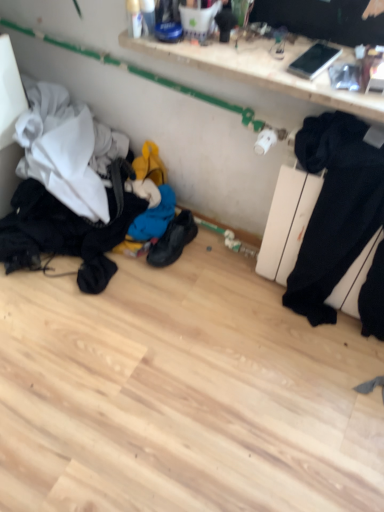
The width and height of the screenshot is (384, 512). I want to click on vacant area that lies between black fabric laundry at lower left and black matte sweat pants at right, so click(203, 297).